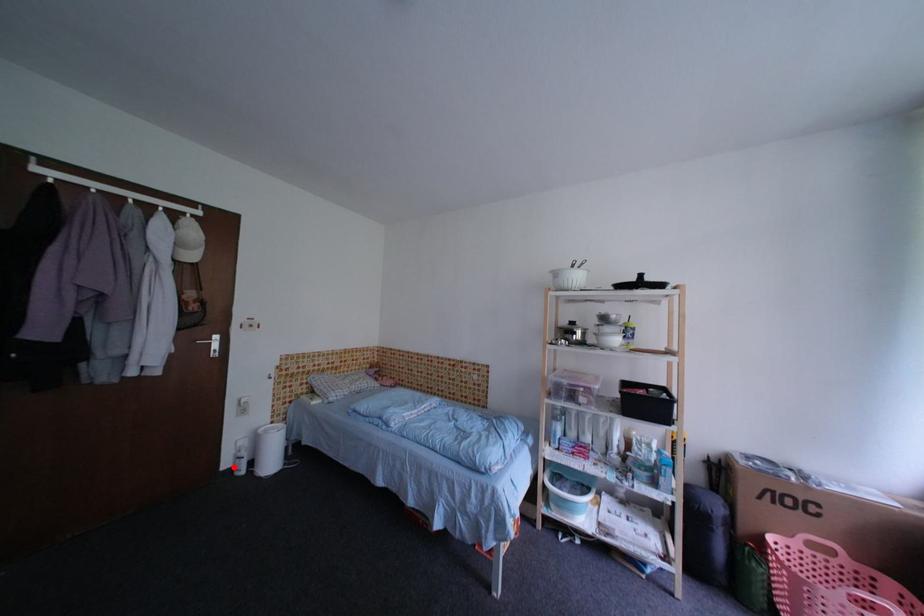
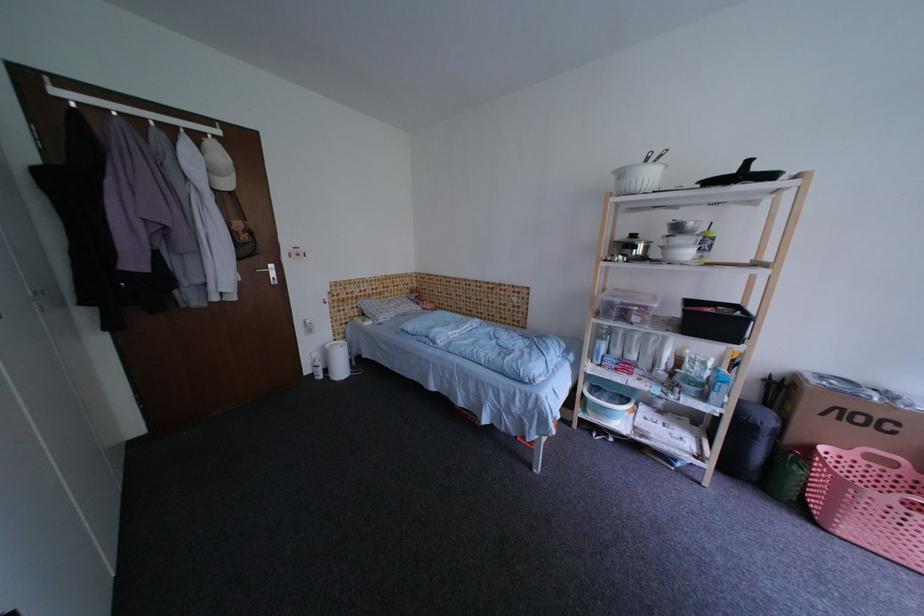
Question: I am providing you with two images of the same scene from different viewpoints. Given a red point in image1, look at the same physical point in image2. Is it:

Choices:
 (A) Closer to the viewpoint
 (B) Farther from the viewpoint

Answer: (A)